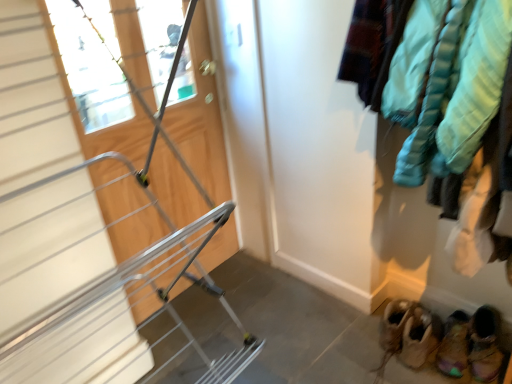
The image size is (512, 384). In order to click on blank space to the left of brown suede moccasins at lower right, the 1th footwear in the left-to-right sequence in this screenshot , I will do `click(366, 352)`.